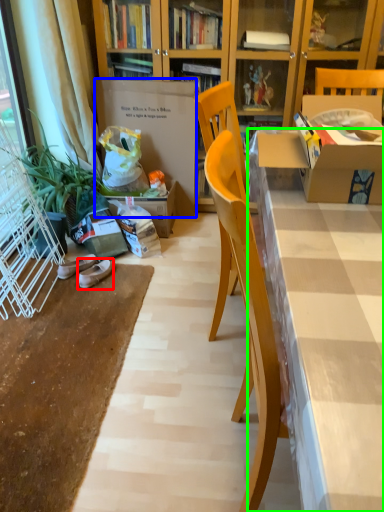
Question: Which object is positioned farthest from footwear (highlighted by a red box)? Select from cardboard box (highlighted by a blue box) and desk (highlighted by a green box).

Choices:
 (A) cardboard box
 (B) desk

Answer: (B)